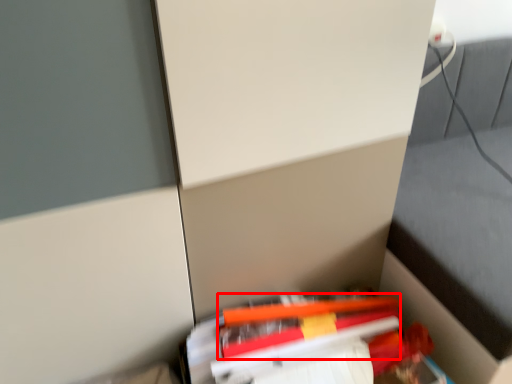
Question: Considering the relative positions of pencil (annotated by the red box) and book in the image provided, where is pencil (annotated by the red box) located with respect to the staircase?

Choices:
 (A) right
 (B) left

Answer: (A)